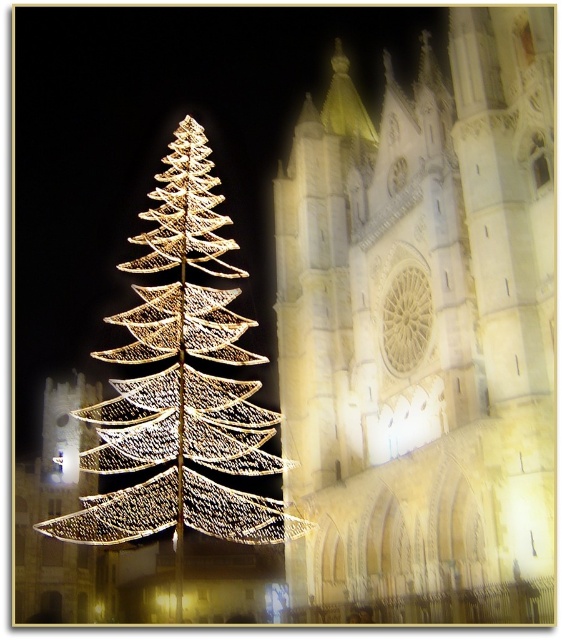
You are standing in the festive night scene and want to take a photo of the illuminated stone tower at center. To ensure the tower is in the center of your photo, where should you aim your camera? Please provide coordinates based on the image grid where the center is at point 0.502, 0.753.

The illuminated stone tower at center is positioned at coordinates (423, 321), so aim your camera at that point to center it in your photo.

You are standing at the base of the illuminated wireframe at left and want to walk to the illuminated stone tower at center. How far will you have to walk?

The illuminated stone tower at center is 39.64 meters from the illuminated wireframe at left, so you will have to walk 39.64 meters to reach it.

You are standing in the festive night scene with the large illuminated Christmas tree on the left and the grand historic building on the right. A point labeled at coordinates (423, 321) is marked. What does this point indicate?

The point at coordinates (423, 321) indicates the illuminated stone tower at center.